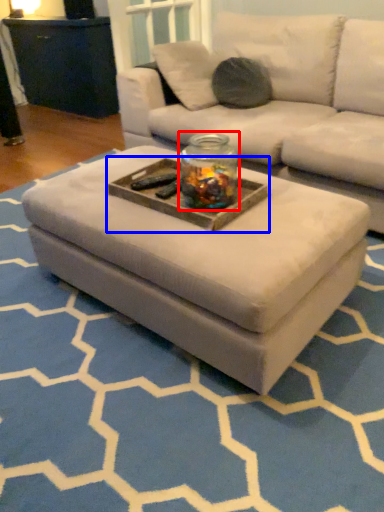
Question: Which of the following is the closest to the observer, glass jar (highlighted by a red box) or tray (highlighted by a blue box)?

Choices:
 (A) glass jar
 (B) tray

Answer: (A)